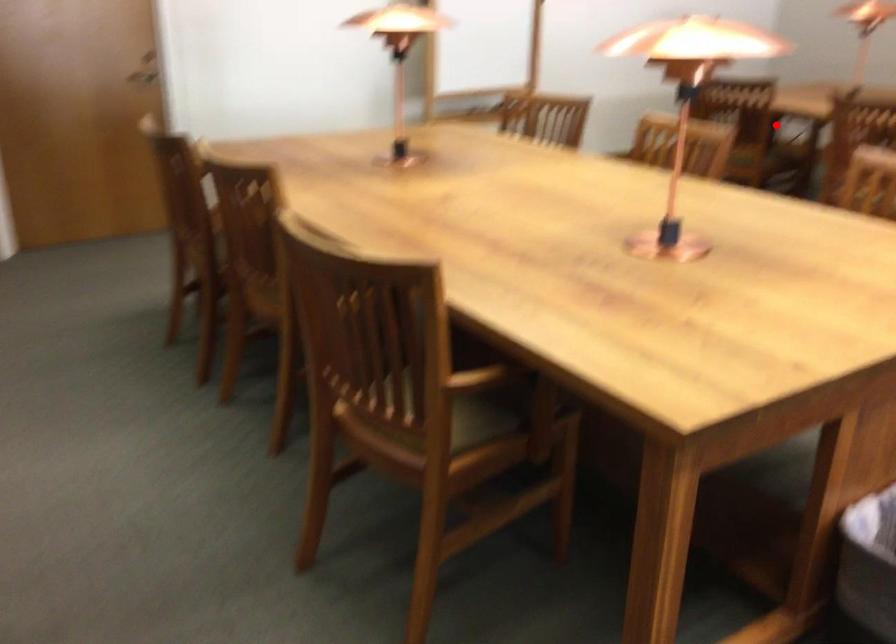
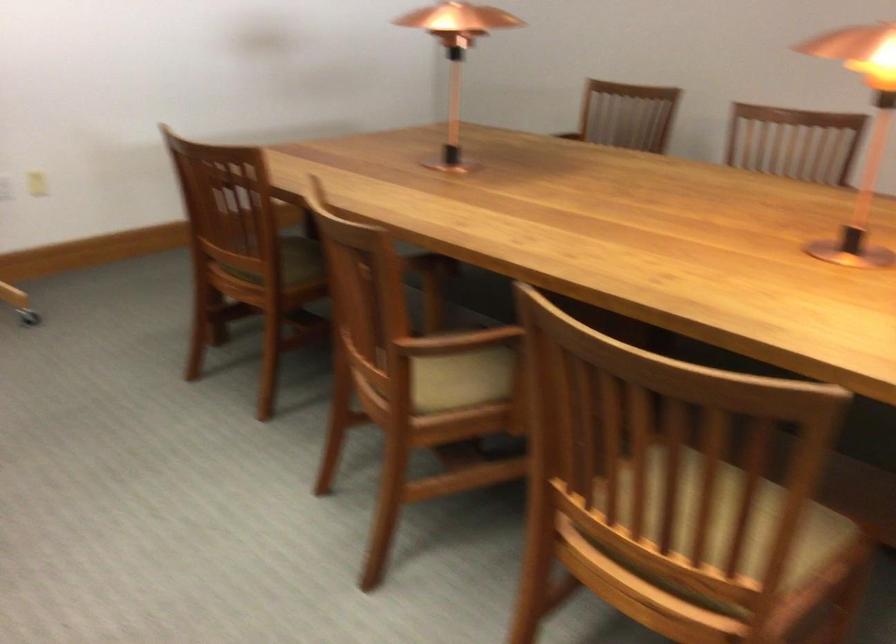
Find the pixel in the second image that matches the highlighted location in the first image.

(289, 263)